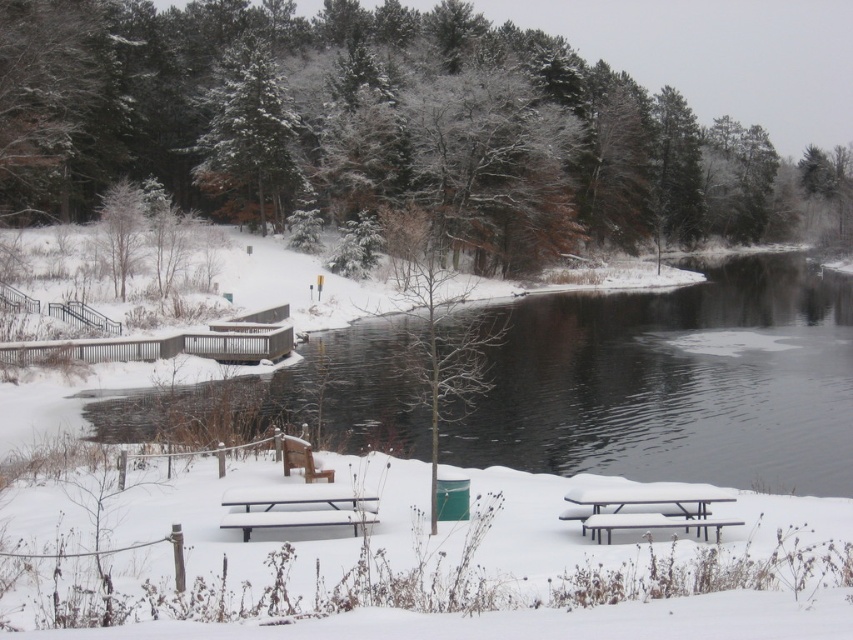
Question: From the image, what is the correct spatial relationship of clear water at center in relation to white metallic picnic table at lower right?

Choices:
 (A) left
 (B) right

Answer: (B)

Question: Which of the following is the farthest from the observer?

Choices:
 (A) (297, 436)
 (B) (669, 170)
 (C) (322, 492)
 (D) (641, 515)

Answer: (B)

Question: Considering the relative positions of clear water at center and wooden bench at center in the image provided, where is clear water at center located with respect to wooden bench at center?

Choices:
 (A) above
 (B) below

Answer: (A)

Question: Which object is farther from the camera taking this photo?

Choices:
 (A) clear water at center
 (B) snow-covered evergreen at upper center
 (C) white plastic picnic table at lower right
 (D) snow-covered tree at upper right

Answer: (D)

Question: Does white plastic picnic table at lower right appear under wooden bench at center?

Choices:
 (A) no
 (B) yes

Answer: (B)

Question: Which of the following is the closest to the observer?

Choices:
 (A) metallic silver bench at center
 (B) snow-covered tree at upper right

Answer: (A)